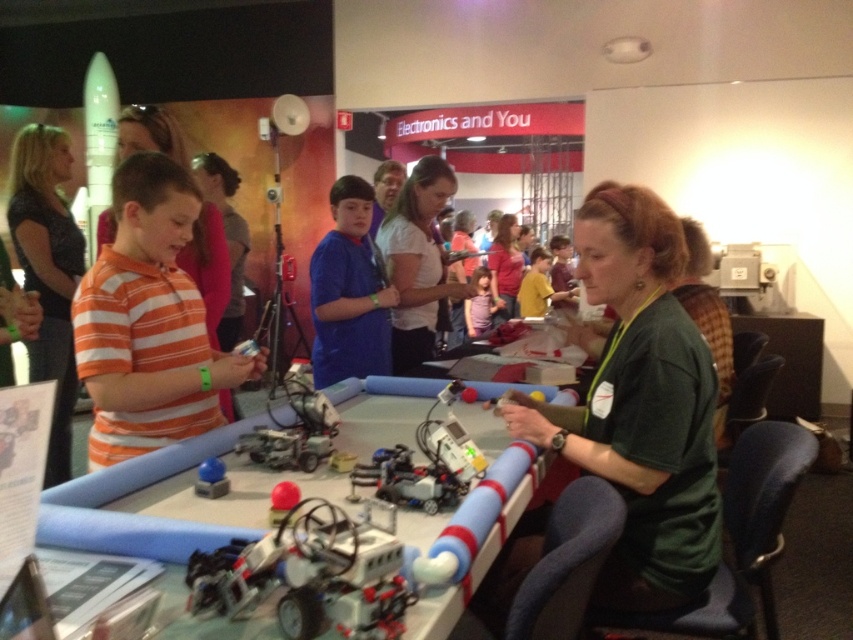
Measure the distance from white matte shirt at center to matte blue button at lower left.

They are 1.72 meters apart.

Who is higher up, white matte shirt at center or matte blue button at lower left?

white matte shirt at center

Is point (399, 227) farther from viewer compared to point (202, 480)?

Yes, point (399, 227) is behind point (202, 480).

Where is `white matte shirt at center`? Image resolution: width=853 pixels, height=640 pixels. white matte shirt at center is located at coordinates (418, 260).

Does dark speckled shirt at upper left have a lesser width compared to matte green shirt at center?

Correct, dark speckled shirt at upper left's width is less than matte green shirt at center's.

Which is below, dark speckled shirt at upper left or matte green shirt at center?

Positioned lower is dark speckled shirt at upper left.

Does point (61, 458) come farther from viewer compared to point (508, 259)?

No, it is not.

This screenshot has height=640, width=853. I want to click on dark speckled shirt at upper left, so click(48, 272).

Between matte green shirt at center and rubberized red ball at center, which one has less height?

rubberized red ball at center is shorter.

Can you confirm if matte green shirt at center is positioned below rubberized red ball at center?

Incorrect, matte green shirt at center is not positioned below rubberized red ball at center.

Does point (515, 291) come behind point (277, 512)?

Yes, it is behind point (277, 512).

At what (x,y) coordinates should I click in order to perform the action: click on matte green shirt at center. Please return your answer as a coordinate pair (x, y). The width and height of the screenshot is (853, 640). Looking at the image, I should click on [505, 268].